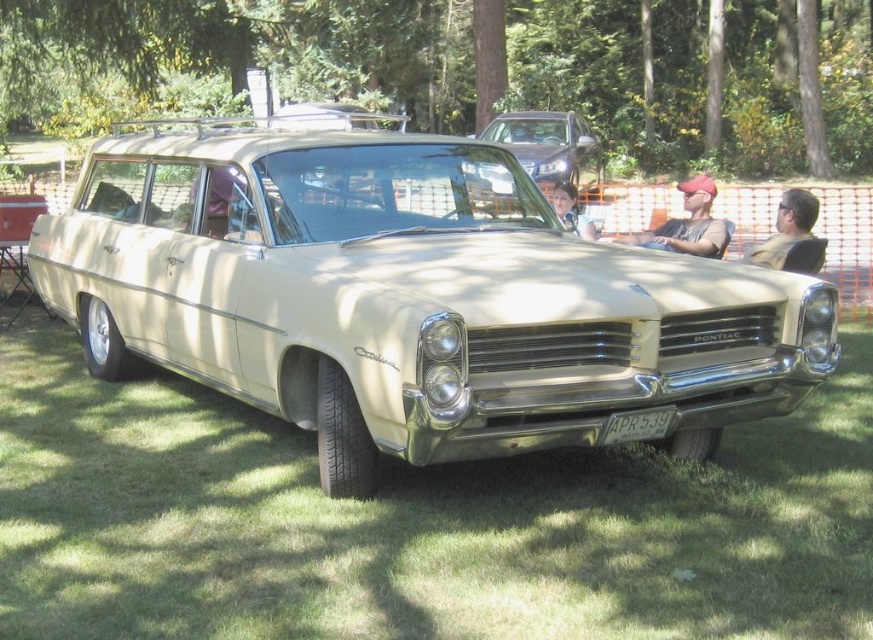
Question: Which point appears closest to the camera in this image?

Choices:
 (A) (265, 266)
 (B) (572, 184)

Answer: (A)

Question: Does green grass at center have a lesser width compared to matte black shirt at center?

Choices:
 (A) no
 (B) yes

Answer: (A)

Question: Which object appears closest to the camera in this image?

Choices:
 (A) brown leather jacket at center
 (B) beige metallic station wagon at center
 (C) metallic silver station wagon at center
 (D) green grass at center

Answer: (D)

Question: Among these objects, which one is farthest from the camera?

Choices:
 (A) green leafy tree at upper center
 (B) brown leather jacket at center
 (C) metallic silver station wagon at center
 (D) green grass at center

Answer: (A)

Question: Does beige metallic station wagon at center have a lesser width compared to matte black shirt at center?

Choices:
 (A) no
 (B) yes

Answer: (A)

Question: Considering the relative positions of brown leather jacket at center and matte black shirt at center in the image provided, where is brown leather jacket at center located with respect to matte black shirt at center?

Choices:
 (A) right
 (B) left

Answer: (A)